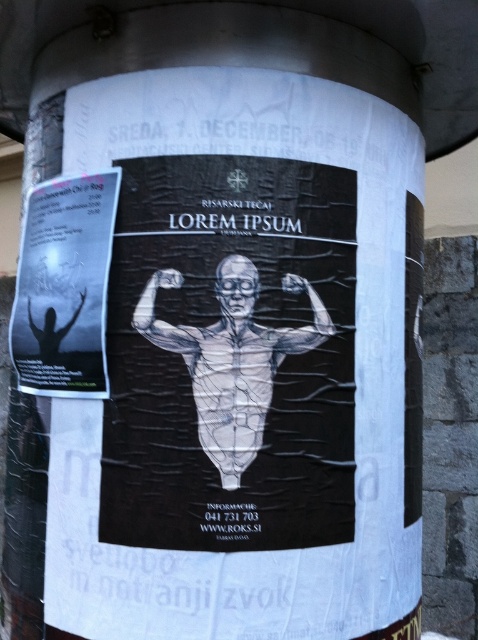
Question: Estimate the real-world distances between objects in this image. Which object is closer to the black paper poster at center?

Choices:
 (A) black paper poster at left
 (B) translucent plastic figure at center

Answer: (B)

Question: Is black paper poster at center bigger than black paper poster at left?

Choices:
 (A) no
 (B) yes

Answer: (B)

Question: Which object is closer to the camera taking this photo?

Choices:
 (A) black paper poster at left
 (B) black paper poster at center

Answer: (B)

Question: Is black paper poster at left positioned in front of translucent plastic figure at center?

Choices:
 (A) no
 (B) yes

Answer: (A)

Question: Which point is closer to the camera?

Choices:
 (A) (85, 314)
 (B) (210, 433)
 (C) (115, 560)

Answer: (B)

Question: Does black paper poster at center appear under translucent plastic figure at center?

Choices:
 (A) yes
 (B) no

Answer: (B)